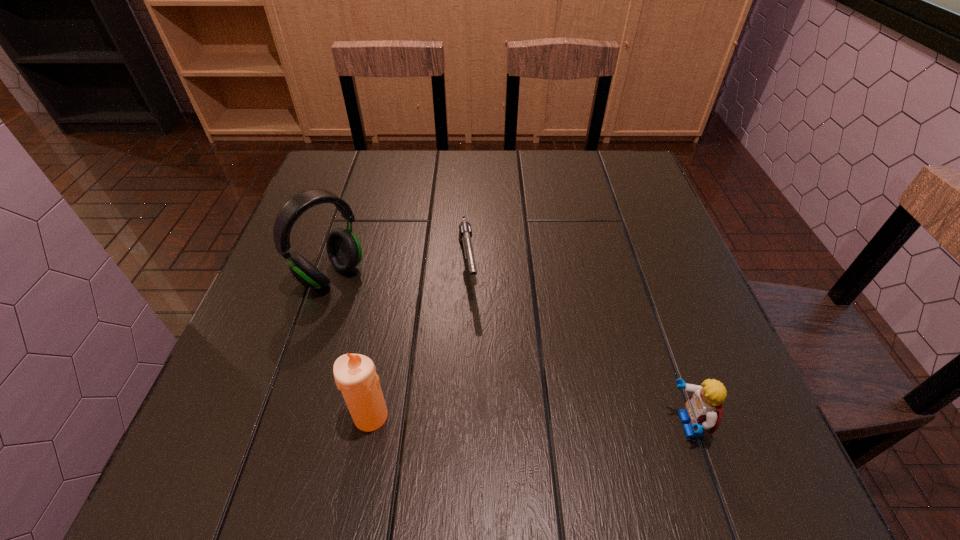
The width and height of the screenshot is (960, 540). I want to click on free space located 0.060m on the ear cups of the leftmost object, so click(369, 307).

The image size is (960, 540). I want to click on free space located on the ear cups of the leftmost object, so click(x=384, y=321).

This screenshot has height=540, width=960. I want to click on free space located on the ear cups of the leftmost object, so click(x=381, y=318).

At what (x,y) coordinates should I click in order to perform the action: click on blank space located aiming along the barrel of the shortest object. Please return your answer as a coordinate pair (x, y). The width and height of the screenshot is (960, 540). Looking at the image, I should click on (473, 338).

This screenshot has height=540, width=960. Find the location of `vacant space located 0.080m aiming along the barrel of the shortest object`. vacant space located 0.080m aiming along the barrel of the shortest object is located at coordinates (472, 334).

Identify the location of vacant area situated 0.150m aiming along the barrel of the shortest object. The image size is (960, 540). 477,365.

Where is `candle at the near edge`? The image size is (960, 540). candle at the near edge is located at coordinates (355, 375).

You are a GUI agent. You are given a task and a screenshot of the screen. Output one action in this format:
    pyautogui.click(x=<x>, y=<y>)
    Task: Click on the Lego that is at the near edge
    The width and height of the screenshot is (960, 540).
    Given the screenshot: What is the action you would take?
    pyautogui.click(x=703, y=411)

The image size is (960, 540). Find the location of `object that is at the left edge`. object that is at the left edge is located at coordinates (344, 251).

The image size is (960, 540). I want to click on object that is positioned at the right edge, so click(x=703, y=411).